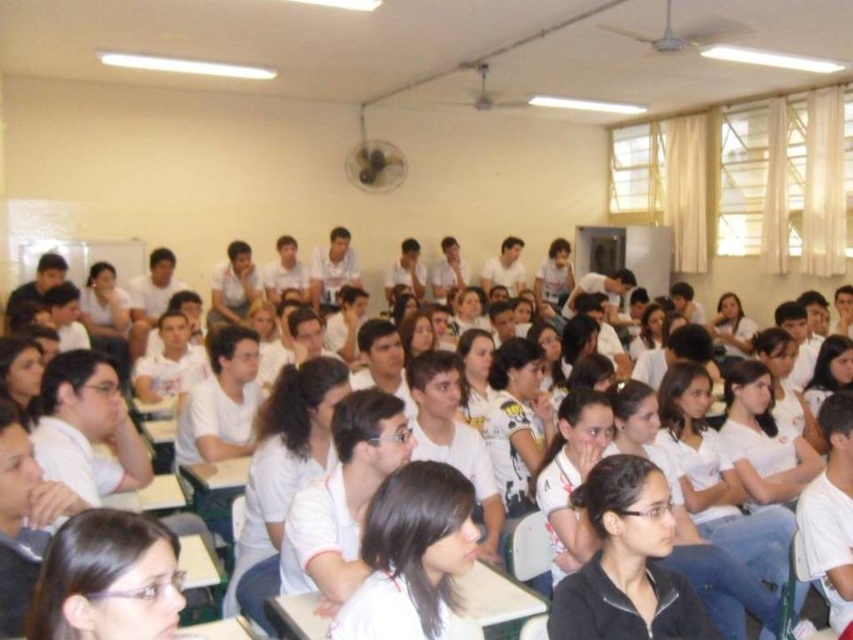
Can you confirm if white matte shirt at center is taller than matte white shirt at lower left?

Yes, white matte shirt at center is taller than matte white shirt at lower left.

Find the location of `white matte shirt at center`. white matte shirt at center is located at coordinates (410, 556).

The width and height of the screenshot is (853, 640). Identify the location of white matte shirt at center. (410, 556).

Which is more to the left, black matte jacket at lower center or white matte shirt at center?

white matte shirt at center is more to the left.

Which is in front, point (651, 614) or point (444, 497)?

Point (444, 497) is in front.

Where is `black matte jacket at lower center`? black matte jacket at lower center is located at coordinates (627, 563).

The height and width of the screenshot is (640, 853). Identify the location of black matte jacket at lower center. (627, 563).

Which is behind, point (585, 595) or point (158, 621)?

The point (585, 595) is more distant.

Is black matte jacket at lower center positioned behind matte white shirt at lower left?

Yes, black matte jacket at lower center is behind matte white shirt at lower left.

Does point (717, 636) lie in front of point (178, 586)?

No, (717, 636) is behind (178, 586).

Where is `black matte jacket at lower center`? The width and height of the screenshot is (853, 640). black matte jacket at lower center is located at coordinates (627, 563).